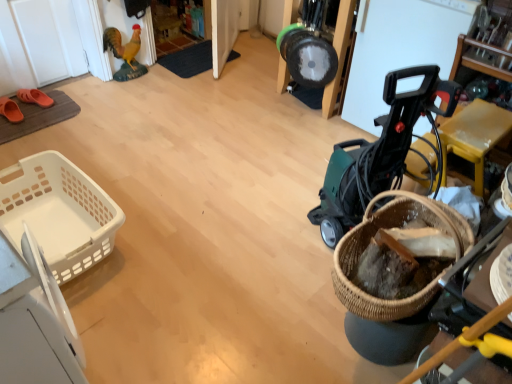
Question: Does orange rubber clog at left, marked as the 2th footwear in a front-to-back arrangement, lie in front of white plastic basket at left, placed as the 1th basket when sorted from left to right?

Choices:
 (A) no
 (B) yes

Answer: (A)

Question: Does orange rubber clog at left, marked as the 2th footwear in a front-to-back arrangement, have a lesser height compared to white plastic basket at left, the 1th basket when ordered from back to front?

Choices:
 (A) yes
 (B) no

Answer: (A)

Question: Is orange rubber clog at left, marked as the 2th footwear in a front-to-back arrangement, looking in the opposite direction of white plastic basket at left, which appears as the 2th basket when viewed from the front?

Choices:
 (A) no
 (B) yes

Answer: (A)

Question: From a real-world perspective, is orange rubber clog at left, which ranks as the 1th footwear in back-to-front order, physically above white plastic basket at left, placed as the 1th basket when sorted from left to right?

Choices:
 (A) yes
 (B) no

Answer: (B)

Question: Considering the relative sizes of orange rubber clog at left, which ranks as the 1th footwear in back-to-front order, and white plastic basket at left, which appears as the 2th basket when viewed from the front, in the image provided, is orange rubber clog at left, which ranks as the 1th footwear in back-to-front order, smaller than white plastic basket at left, which appears as the 2th basket when viewed from the front,?

Choices:
 (A) yes
 (B) no

Answer: (A)

Question: Is orange rubber clog at left, which ranks as the 1th footwear in back-to-front order, far away from white plastic basket at left, the 1th basket when ordered from back to front?

Choices:
 (A) no
 (B) yes

Answer: (B)

Question: Does white plastic basket at left, which appears as the 2th basket when viewed from the front, come in front of green plastic baby carriage at right?

Choices:
 (A) no
 (B) yes

Answer: (A)

Question: Is white plastic basket at left, the 1th basket when ordered from back to front, turned away from green plastic baby carriage at right?

Choices:
 (A) no
 (B) yes

Answer: (A)

Question: Is white plastic basket at left, which appears as the 2th basket when viewed from the front, aimed at green plastic baby carriage at right?

Choices:
 (A) yes
 (B) no

Answer: (B)

Question: Is white plastic basket at left, placed as the second basket when sorted from right to left, thinner than green plastic baby carriage at right?

Choices:
 (A) no
 (B) yes

Answer: (B)

Question: Is white plastic basket at left, placed as the second basket when sorted from right to left, at the right side of green plastic baby carriage at right?

Choices:
 (A) yes
 (B) no

Answer: (B)

Question: Can you confirm if white plastic basket at left, placed as the second basket when sorted from right to left, is shorter than green plastic baby carriage at right?

Choices:
 (A) yes
 (B) no

Answer: (A)

Question: Does woven brown basket at lower right, the first basket viewed from the right, lie behind orange rubber clog at left, marked as the 2th footwear in a front-to-back arrangement?

Choices:
 (A) yes
 (B) no

Answer: (B)